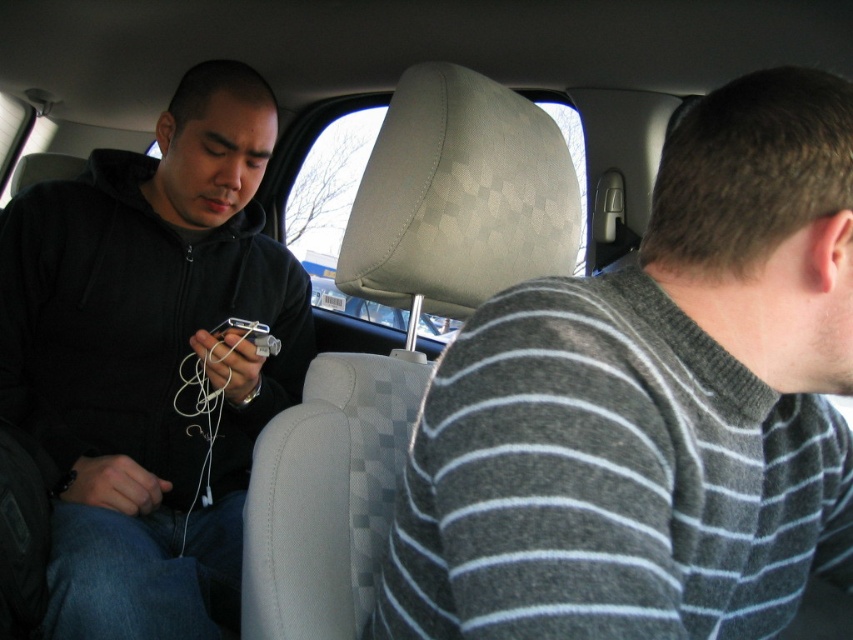
Which of these two, gray striped sweater at right or black matte hoodie at left, stands shorter?

Standing shorter between the two is gray striped sweater at right.

Between point (531, 481) and point (9, 227), which one is positioned behind?

Point (9, 227)

Identify the location of gray striped sweater at right. (653, 406).